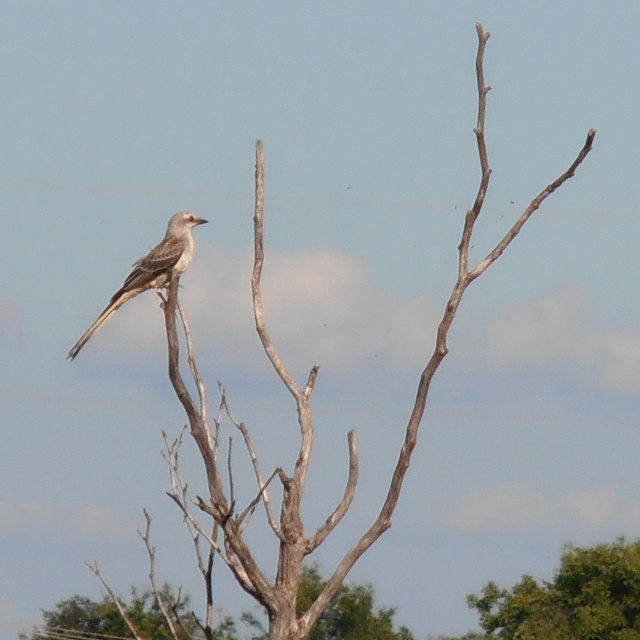
You are a birdwatcher trying to determine which tree is taller between the green leafy tree at lower right and the brown rough tree trunk at center. Based on the scene, which tree is taller?

The green leafy tree at lower right is taller than the brown rough tree trunk at center according to the description.